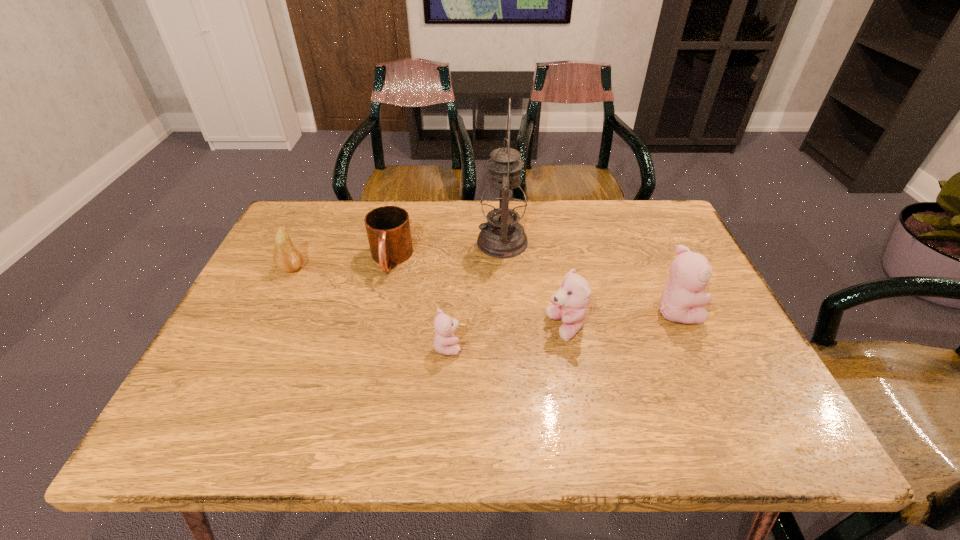
At what (x,y) coordinates should I click in order to perform the action: click on object positioned at the right edge. Please return your answer as a coordinate pair (x, y). Looking at the image, I should click on (681, 302).

Locate an element on the screen. The height and width of the screenshot is (540, 960). vacant space at the far edge of the desktop is located at coordinates (531, 208).

In the image, there is a desktop. Find the location of `vacant space at the near edge`. vacant space at the near edge is located at coordinates (664, 399).

Identify the location of vacant space at the left edge of the desktop. (282, 314).

In the image, there is a desktop. At what (x,y) coordinates should I click in order to perform the action: click on vacant space at the far left corner. Please return your answer as a coordinate pair (x, y). Image resolution: width=960 pixels, height=540 pixels. Looking at the image, I should click on (309, 219).

Image resolution: width=960 pixels, height=540 pixels. Identify the location of vacant area at the near left corner. (267, 367).

The height and width of the screenshot is (540, 960). Identify the location of free space at the far right corner of the desktop. (626, 209).

Where is `free space at the near right corner of the desktop`? free space at the near right corner of the desktop is located at coordinates (731, 391).

Where is `empty location between the oil lamp and the second teddy bear from right to left`? This screenshot has height=540, width=960. empty location between the oil lamp and the second teddy bear from right to left is located at coordinates (534, 285).

Where is `free spot between the fifth object from right to left and the second teddy bear from right to left`? The image size is (960, 540). free spot between the fifth object from right to left and the second teddy bear from right to left is located at coordinates pos(478,293).